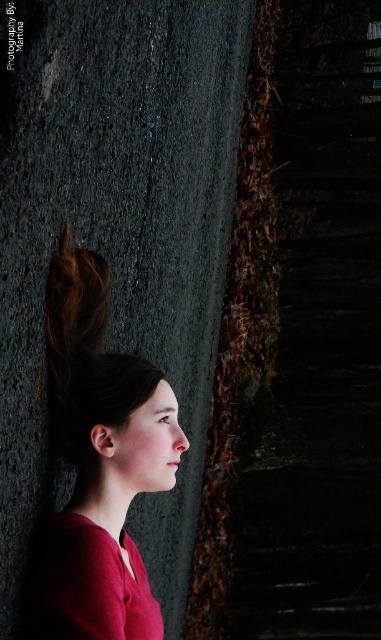
Is matte red shirt at left to the left of dark brown silky hair at center from the viewer's perspective?

Incorrect, matte red shirt at left is not on the left side of dark brown silky hair at center.

Describe the element at coordinates (99, 465) in the screenshot. This screenshot has width=381, height=640. I see `matte red shirt at left` at that location.

Identify the location of matte red shirt at left. (99, 465).